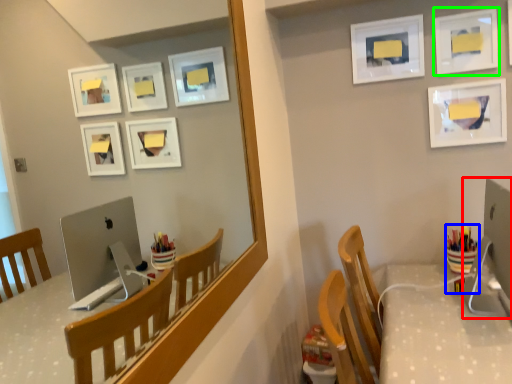
Question: Which object is the closest to the desktop computer (highlighted by a red box)? Choose among these: stationery (highlighted by a blue box) or picture frame (highlighted by a green box).

Choices:
 (A) stationery
 (B) picture frame

Answer: (A)